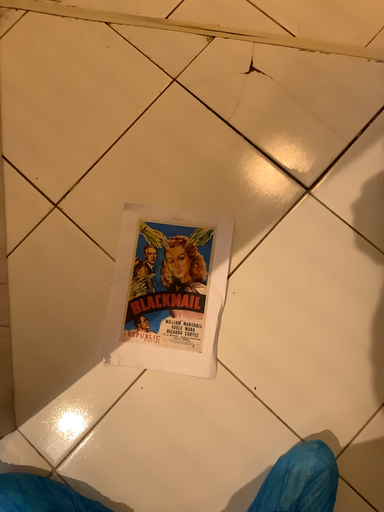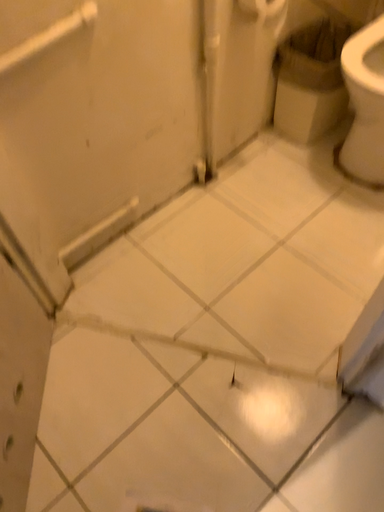
Question: Which way did the camera rotate in the video?

Choices:
 (A) rotated downward
 (B) rotated upward

Answer: (B)